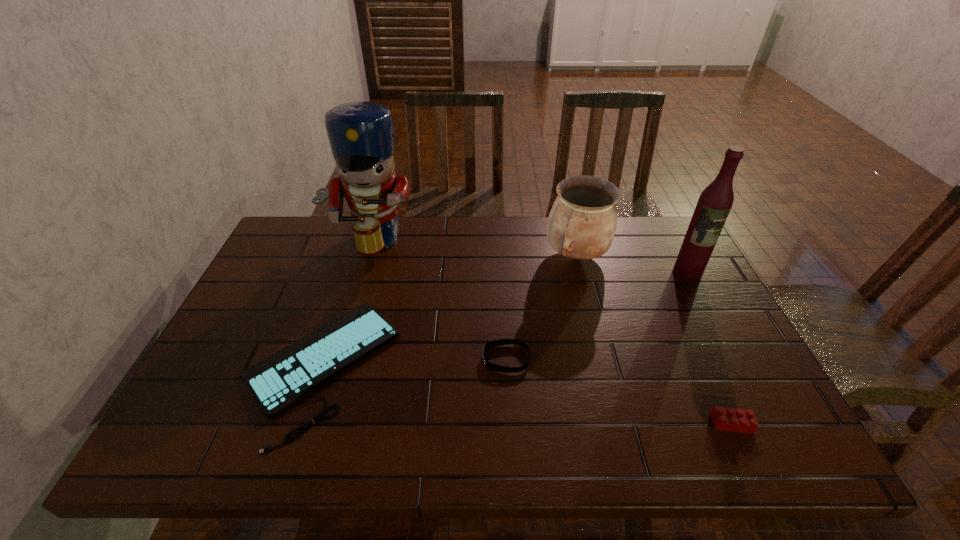
Locate an element on the screen. This screenshot has width=960, height=540. free area in between the liquor and the third shortest object is located at coordinates (709, 349).

At what (x,y) coordinates should I click in order to perform the action: click on empty location between the liquor and the fourth object from right to left. Please return your answer as a coordinate pair (x, y). The height and width of the screenshot is (540, 960). Looking at the image, I should click on (596, 316).

Locate an element on the screen. free space that is in between the fourth shortest object and the computer keyboard is located at coordinates (447, 312).

Find the location of a particular element. This screenshot has height=540, width=960. empty space between the liquor and the computer keyboard is located at coordinates (503, 321).

Identify the location of empty space that is in between the liquor and the third object from right to left. The image size is (960, 540). (631, 265).

Image resolution: width=960 pixels, height=540 pixels. I want to click on blank region between the urn and the third shortest object, so (654, 340).

This screenshot has height=540, width=960. In order to click on empty space that is in between the Lego and the liquor in this screenshot , I will do `click(709, 349)`.

The image size is (960, 540). In order to click on vacant area that lies between the nutcracker and the urn in this screenshot , I will do `click(472, 247)`.

Where is `free space between the third tallest object and the nutcracker`? The image size is (960, 540). free space between the third tallest object and the nutcracker is located at coordinates (472, 247).

At what (x,y) coordinates should I click in order to perform the action: click on unoccupied position between the computer keyboard and the nutcracker. Please return your answer as a coordinate pair (x, y). This screenshot has width=960, height=540. Looking at the image, I should click on (344, 303).